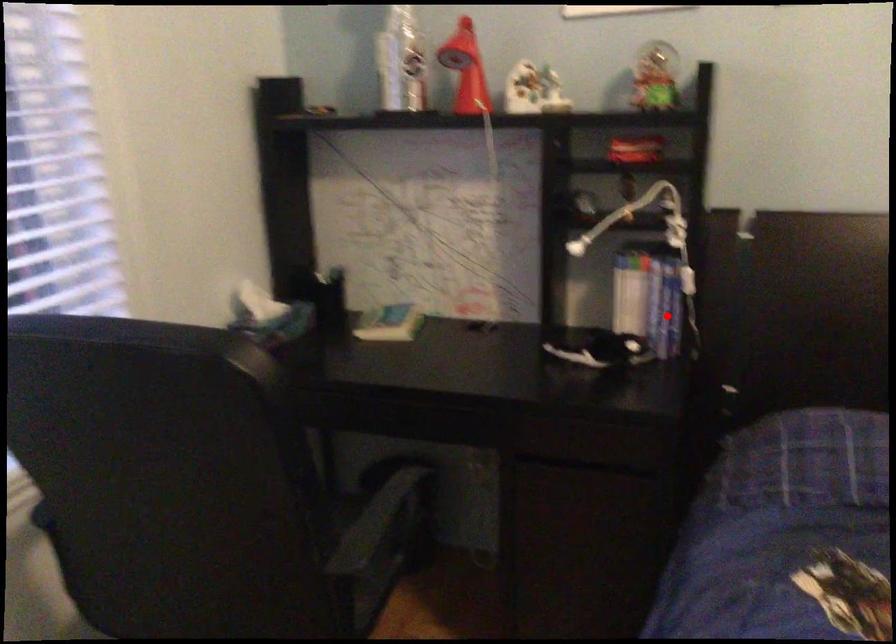
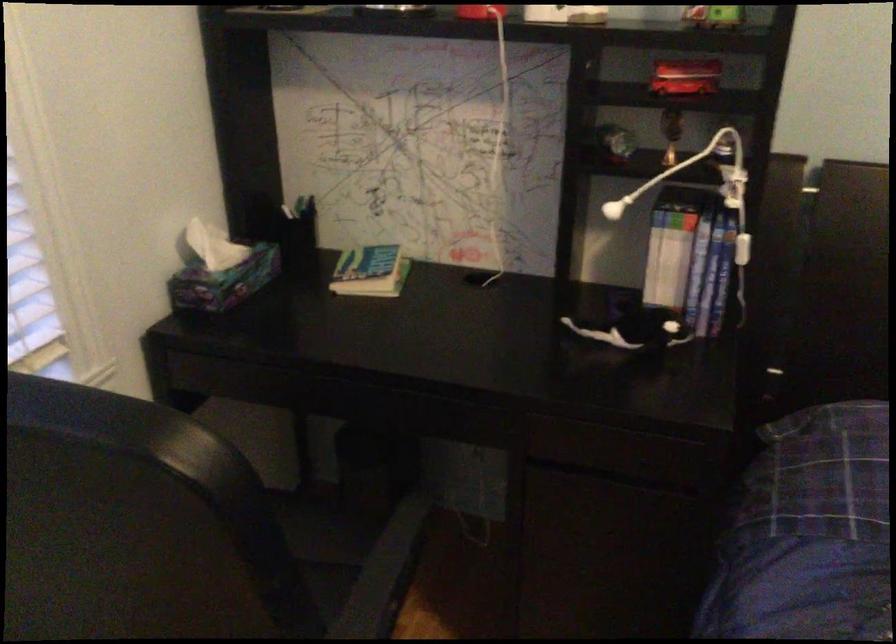
Where in the second image is the point corresponding to the highlighted location from the first image?

(707, 288)